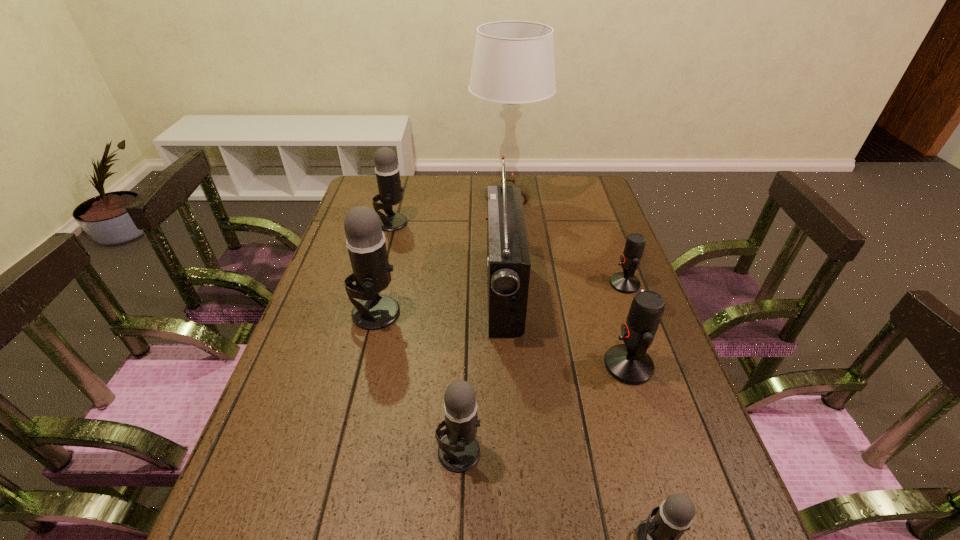
You are a GUI agent. You are given a task and a screenshot of the screen. Output one action in this format:
    pyautogui.click(x=<x>, y=<y>)
    Task: Click on the smaller red microphone
    
    Given the screenshot: What is the action you would take?
    pyautogui.click(x=625, y=282)

Image resolution: width=960 pixels, height=540 pixels. Identify the location of the second farthest microphone. [x=625, y=282].

The image size is (960, 540). Find the location of `vacant space positioned 0.330m on the front-facing side of the tallest object`. vacant space positioned 0.330m on the front-facing side of the tallest object is located at coordinates (380, 199).

Locate an element on the screen. This screenshot has width=960, height=540. free space located on the front-facing side of the tallest object is located at coordinates (361, 199).

You are a GUI agent. You are given a task and a screenshot of the screen. Output one action in this format:
    pyautogui.click(x=<x>, y=<y>)
    Task: Click on the vacant space located 0.310m on the front-facing side of the tallest object
    The width and height of the screenshot is (960, 540).
    Given the screenshot: What is the action you would take?
    pyautogui.click(x=386, y=199)

At what (x,y) coordinates should I click in order to perform the action: click on vacant region located 0.200m on the front-facing side of the radio receiver. Please return your answer as a coordinate pair (x, y). This screenshot has height=540, width=960. Looking at the image, I should click on (415, 292).

Find the location of a particular element. This screenshot has height=540, width=960. free region located on the front-facing side of the radio receiver is located at coordinates (348, 292).

Locate an element on the screen. blank area located on the front-facing side of the radio receiver is located at coordinates (365, 292).

Locate an element on the screen. This screenshot has height=540, width=960. vacant space located on the right of the fourth nearest microphone is located at coordinates 464,312.

Locate an element on the screen. The image size is (960, 540). free spot located 0.050m on the front of the second tallest microphone is located at coordinates (387, 241).